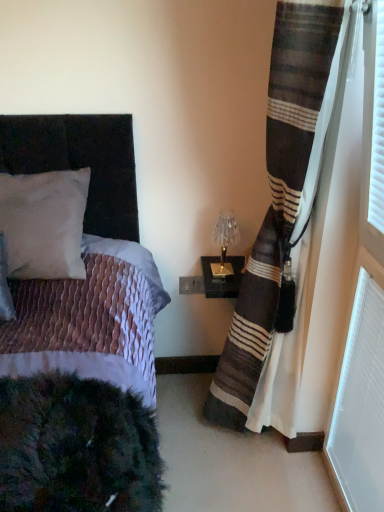
Question: Does gold metallic table lamp at upper right have a lesser height compared to velvet black bed at left?

Choices:
 (A) no
 (B) yes

Answer: (B)

Question: Can you confirm if gold metallic table lamp at upper right is smaller than velvet black bed at left?

Choices:
 (A) no
 (B) yes

Answer: (B)

Question: From a real-world perspective, does gold metallic table lamp at upper right sit lower than velvet black bed at left?

Choices:
 (A) yes
 (B) no

Answer: (B)

Question: Considering the relative sizes of gold metallic table lamp at upper right and velvet black bed at left in the image provided, is gold metallic table lamp at upper right thinner than velvet black bed at left?

Choices:
 (A) no
 (B) yes

Answer: (B)

Question: Is gold metallic table lamp at upper right aimed at velvet black bed at left?

Choices:
 (A) no
 (B) yes

Answer: (A)

Question: In terms of width, does striped fabric curtain at right look wider or thinner when compared to white textured radiator at lower right?

Choices:
 (A) thin
 (B) wide

Answer: (B)

Question: Considering the positions of point (264, 357) and point (347, 380), is point (264, 357) closer or farther from the camera than point (347, 380)?

Choices:
 (A) closer
 (B) farther

Answer: (B)

Question: In terms of height, does striped fabric curtain at right look taller or shorter compared to white textured radiator at lower right?

Choices:
 (A) tall
 (B) short

Answer: (A)

Question: From the image's perspective, is striped fabric curtain at right located above or below white textured radiator at lower right?

Choices:
 (A) below
 (B) above

Answer: (B)

Question: Considering the positions of point (215, 264) and point (284, 1), is point (215, 264) closer or farther from the camera than point (284, 1)?

Choices:
 (A) farther
 (B) closer

Answer: (A)

Question: From a real-world perspective, is gold metallic table lamp at upper right above or below striped fabric curtain at right?

Choices:
 (A) below
 (B) above

Answer: (A)

Question: In terms of size, does gold metallic table lamp at upper right appear bigger or smaller than striped fabric curtain at right?

Choices:
 (A) big
 (B) small

Answer: (B)

Question: Choose the correct answer: Is gold metallic table lamp at upper right inside striped fabric curtain at right or outside it?

Choices:
 (A) outside
 (B) inside

Answer: (A)

Question: Is white textured radiator at lower right situated inside white matte pillow at upper left or outside?

Choices:
 (A) inside
 (B) outside

Answer: (B)

Question: Would you say white textured radiator at lower right is to the left or to the right of white matte pillow at upper left in the picture?

Choices:
 (A) right
 (B) left

Answer: (A)